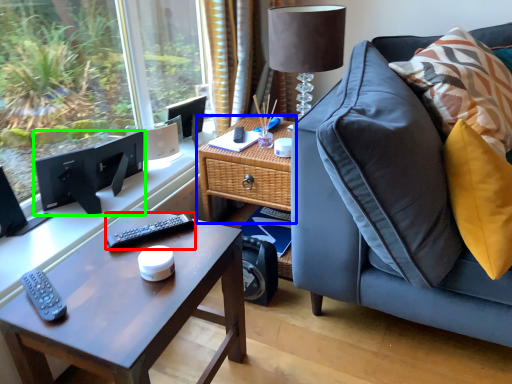
Question: Based on their relative distances, which object is nearer to remote (highlighted by a red box)? Choose from table (highlighted by a blue box) and computer monitor (highlighted by a green box).

Choices:
 (A) table
 (B) computer monitor

Answer: (A)